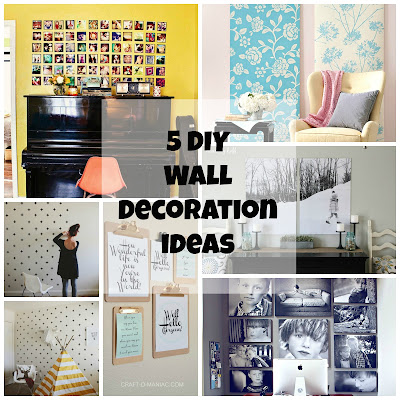
Where is `clipboards`? The width and height of the screenshot is (400, 400). clipboards is located at coordinates (130, 223), (161, 264), (168, 308), (110, 330).